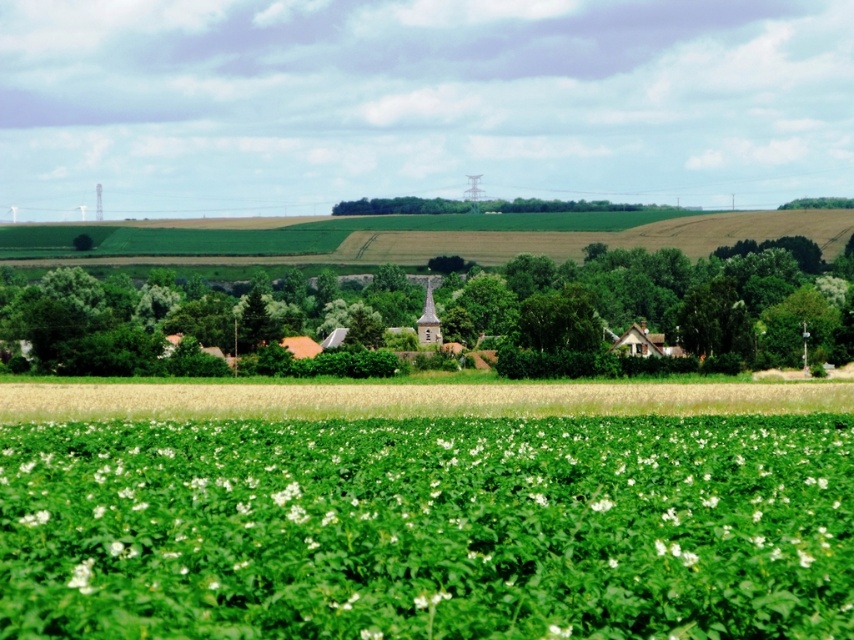
You are standing in the rural landscape and want to walk from the point closer to you to the point further away. Which path would you take between the point at coordinates point [529,576] and point [460,298]?

The point at coordinates point [529,576] is closer to you, so you would walk towards the point at coordinates point [460,298] which is further away.

You are standing at the center of the image and want to find the green leafy tree at center. According to the coordinates provided, in which direction should you look to locate it?

The green leafy tree at center is located at coordinates point (654, 307), which is slightly to the upper right from the exact center. So you should look towards the upper right direction from the center to locate it.

You are a farmer checking the growth of crops in your field. You notice a green leafy plant at center and a green grassy field at center. Which one is taller?

The green leafy plant at center is taller than the green grassy field at center.